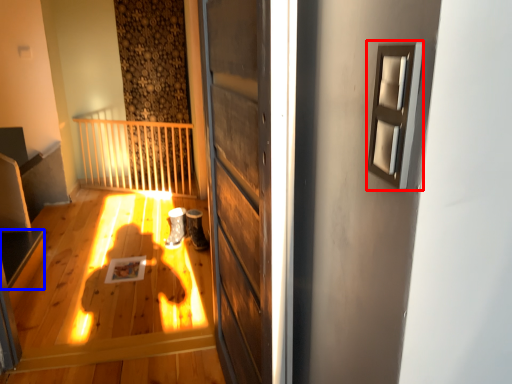
Question: Among these objects, which one is farthest to the camera, window (highlighted by a red box) or stairwell (highlighted by a blue box)?

Choices:
 (A) window
 (B) stairwell

Answer: (B)